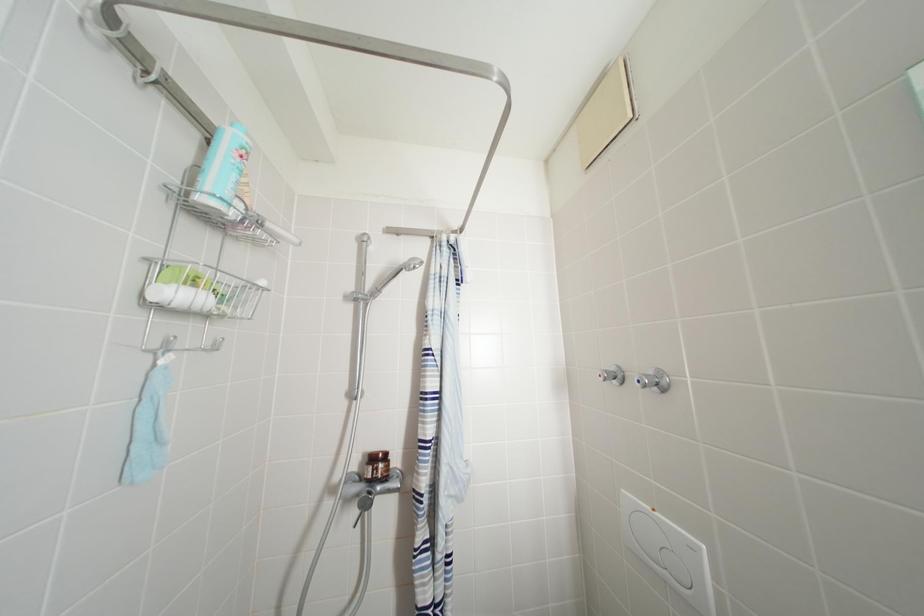
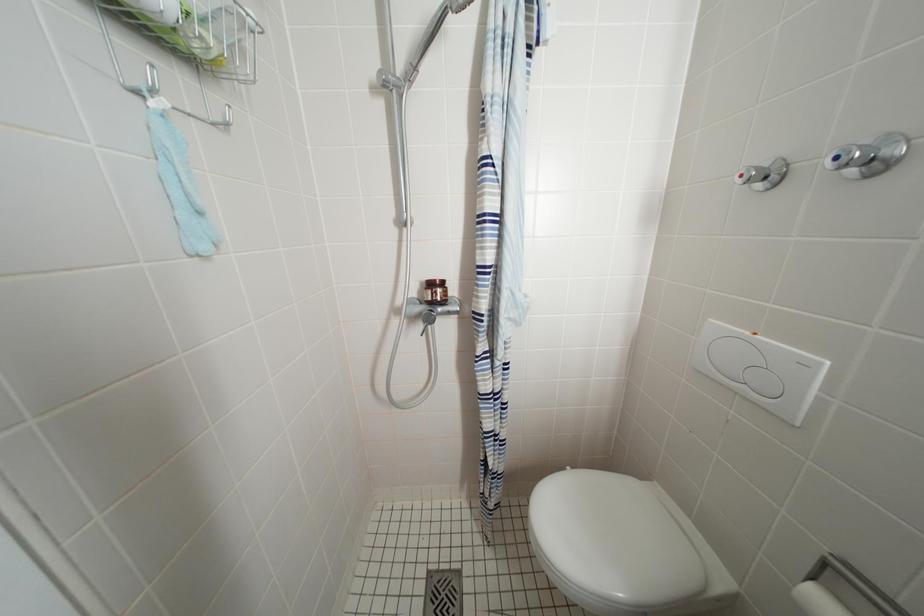
Question: The first image is from the beginning of the video and the second image is from the end. How did the camera likely rotate when shooting the video?

Choices:
 (A) Left
 (B) Right
 (C) Up
 (D) Down

Answer: (D)